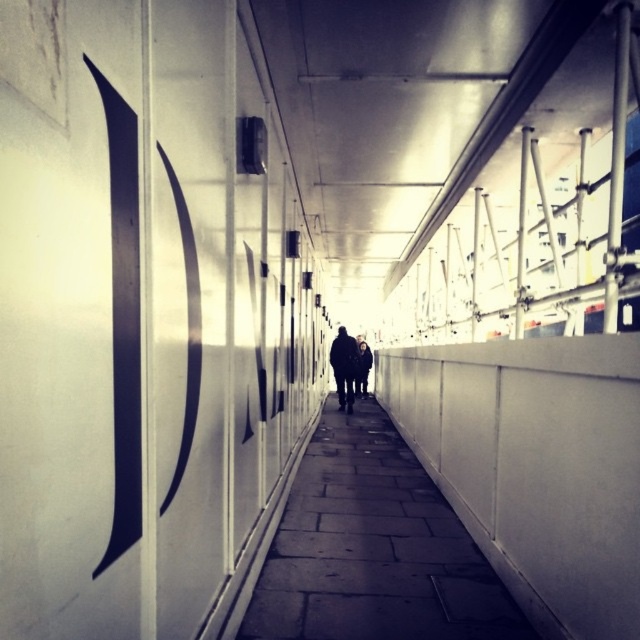
Is dark gray stone pavement at center to the left of dark wool coat at center from the viewer's perspective?

Incorrect, dark gray stone pavement at center is not on the left side of dark wool coat at center.

At what (x,y) coordinates should I click in order to perform the action: click on dark gray stone pavement at center. Please return your answer as a coordinate pair (x, y). Looking at the image, I should click on (372, 548).

Does dark gray stone pavement at center have a lesser width compared to dark gray jacket at center?

In fact, dark gray stone pavement at center might be wider than dark gray jacket at center.

Is dark gray stone pavement at center in front of dark gray jacket at center?

Yes, it is in front of dark gray jacket at center.

Which is behind, point (492, 572) or point (362, 387)?

The point (362, 387) is behind.

I want to click on dark gray stone pavement at center, so click(x=372, y=548).

The image size is (640, 640). Describe the element at coordinates (344, 368) in the screenshot. I see `dark wool coat at center` at that location.

The width and height of the screenshot is (640, 640). What do you see at coordinates (344, 368) in the screenshot? I see `dark wool coat at center` at bounding box center [344, 368].

Where is `dark wool coat at center`? The width and height of the screenshot is (640, 640). dark wool coat at center is located at coordinates (344, 368).